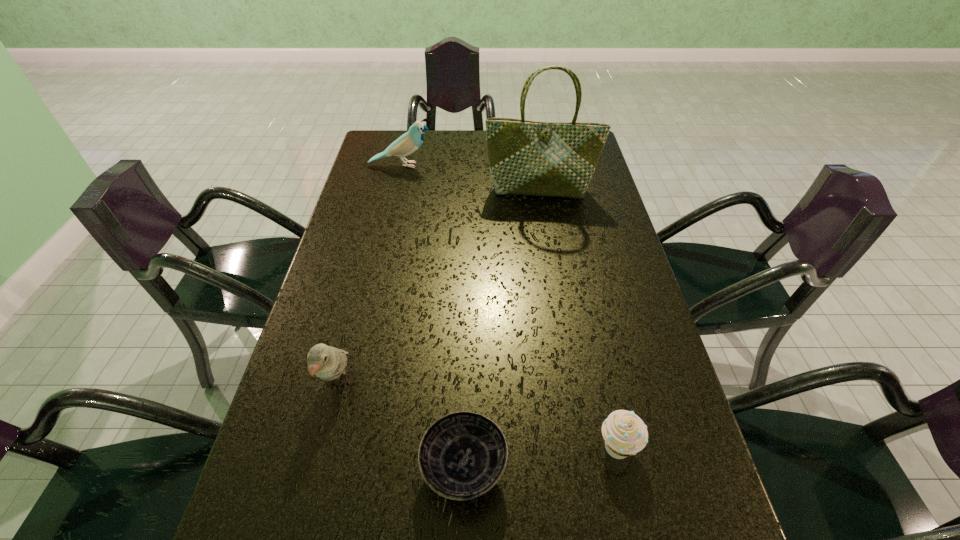
At what (x,y) coordinates should I click in order to perform the action: click on shopping bag. Please return your answer as a coordinate pair (x, y). This screenshot has width=960, height=540. Looking at the image, I should click on (525, 157).

I want to click on the second farthest object, so click(525, 157).

This screenshot has width=960, height=540. I want to click on the farthest object, so click(x=409, y=142).

Locate an element on the screen. the third farthest object is located at coordinates (328, 363).

At what (x,y) coordinates should I click in order to perform the action: click on muffin. Please return your answer as a coordinate pair (x, y). The height and width of the screenshot is (540, 960). Looking at the image, I should click on (625, 434).

You are a GUI agent. You are given a task and a screenshot of the screen. Output one action in this format:
    pyautogui.click(x=<x>, y=<y>)
    Task: Click on the bowl
    Image resolution: width=960 pixels, height=540 pixels.
    Given the screenshot: What is the action you would take?
    pyautogui.click(x=462, y=455)

The image size is (960, 540). Find the location of `free spot located 0.380m on the left of the shopping bag`. free spot located 0.380m on the left of the shopping bag is located at coordinates (369, 191).

The width and height of the screenshot is (960, 540). I want to click on vacant space located 0.270m at the face of the farthest object, so click(512, 165).

Locate an element on the screen. The width and height of the screenshot is (960, 540). vacant region located at the face of the third nearest object is located at coordinates (308, 504).

Find the location of a particular element. This screenshot has height=540, width=960. free space located on the back of the muffin is located at coordinates (596, 353).